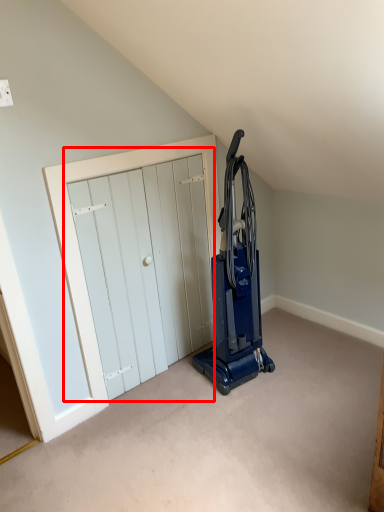
Question: Observing the image, what is the correct spatial positioning of door (annotated by the red box) in reference to home appliance?

Choices:
 (A) right
 (B) left

Answer: (B)